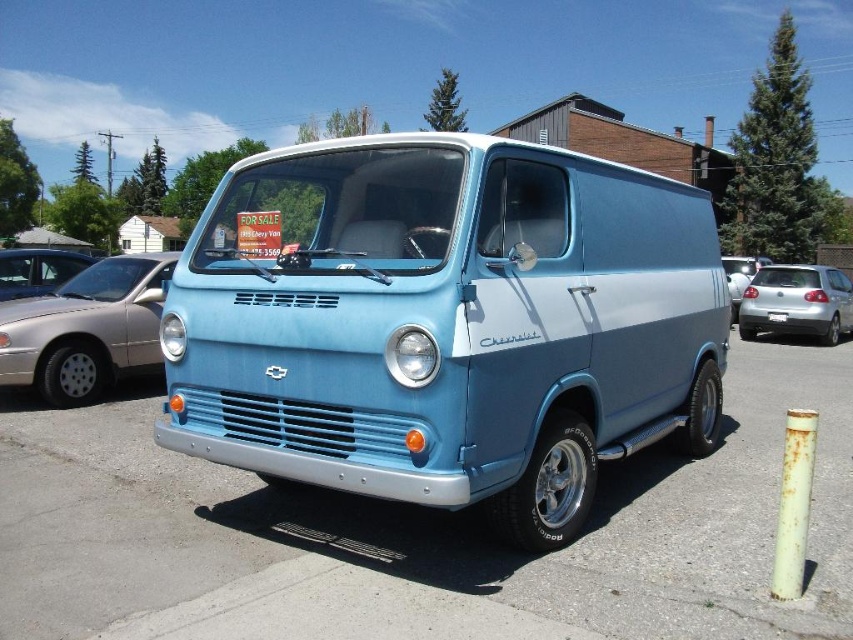
Can you confirm if matte blue van at center is shorter than satin silver car at center?

Indeed, matte blue van at center has a lesser height compared to satin silver car at center.

Where is `matte blue van at center`? This screenshot has height=640, width=853. matte blue van at center is located at coordinates (86, 328).

Who is more distant from viewer, (44, 339) or (740, 305)?

Point (740, 305)

The width and height of the screenshot is (853, 640). In order to click on matte blue van at center in this screenshot , I will do `click(86, 328)`.

In the scene shown: Which is more to the right, light blue metallic van at center or matte blue van at center?

light blue metallic van at center

Is light blue metallic van at center thinner than matte blue van at center?

In fact, light blue metallic van at center might be wider than matte blue van at center.

Does point (608, 212) come behind point (152, 324)?

No.

Where is `light blue metallic van at center`? light blue metallic van at center is located at coordinates (445, 323).

Does matte blue van at center lie behind matte silver car at left?

No, it is in front of matte silver car at left.

Looking at this image, does matte blue van at center lie in front of matte silver car at left?

Yes, matte blue van at center is in front of matte silver car at left.

Between point (62, 401) and point (47, 253), which one is positioned in front?

Point (62, 401) is more forward.

The image size is (853, 640). Identify the location of matte blue van at center. point(86,328).